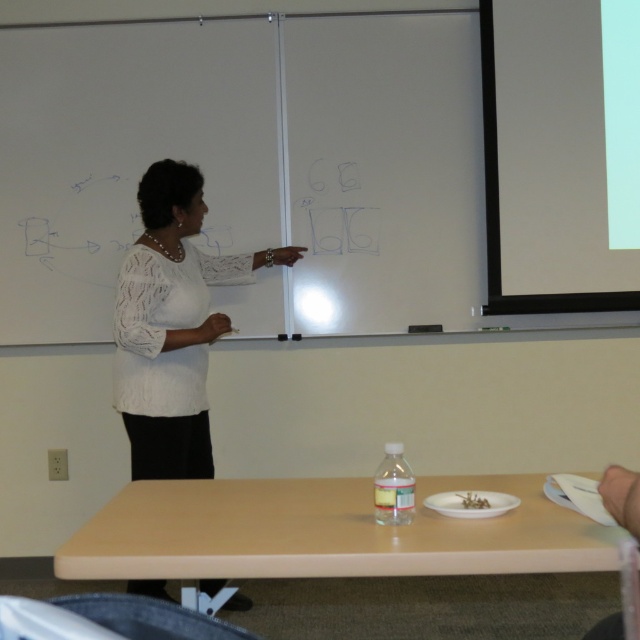
You are a student sitting in the classroom and need to place your laptop on the light brown laminate table at lower center. However, you notice the white lace blouse at upper center. Will the table be wide enough to accommodate your laptop without overlapping the blouse?

The light brown laminate table at lower center is wider than the white lace blouse at upper center, so yes, the table should be wide enough to place your laptop without overlapping the blouse.